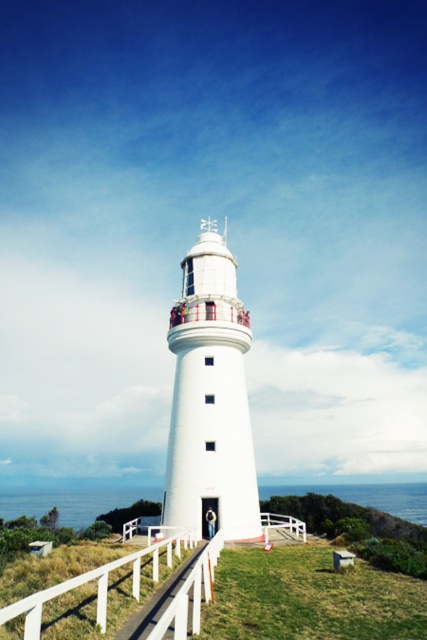
Is the position of white smooth lighthouse at center less distant than that of white wooden rail at center?

No, white smooth lighthouse at center is further to the viewer.

Between point (248, 310) and point (158, 576), which one is positioned in front?

Positioned in front is point (158, 576).

Locate an element on the screen. This screenshot has width=427, height=640. white smooth lighthouse at center is located at coordinates (210, 397).